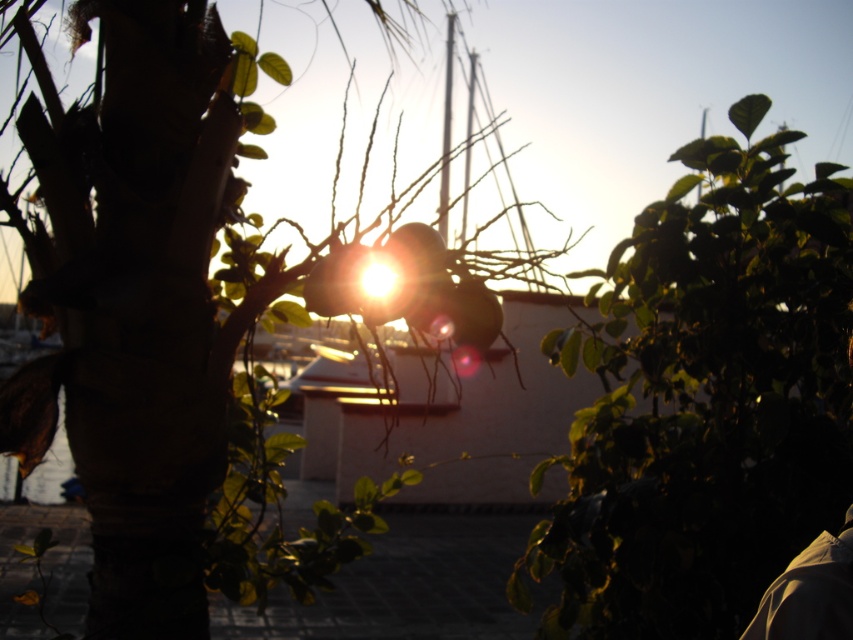
Question: Considering the relative positions of green leafy tree at center and green leafy plant at upper right in the image provided, where is green leafy tree at center located with respect to green leafy plant at upper right?

Choices:
 (A) above
 (B) below

Answer: (A)

Question: Does green leafy tree at center appear on the left side of green leafy plant at upper right?

Choices:
 (A) yes
 (B) no

Answer: (A)

Question: Can you confirm if green leafy tree at center is thinner than green leafy plant at upper right?

Choices:
 (A) yes
 (B) no

Answer: (B)

Question: Which object is closer to the camera taking this photo?

Choices:
 (A) green leafy plant at upper right
 (B) green leafy tree at center

Answer: (B)

Question: Which point is farther to the camera?

Choices:
 (A) green leafy tree at center
 (B) green leafy plant at upper right

Answer: (B)

Question: Among these points, which one is nearest to the camera?

Choices:
 (A) (637, 305)
 (B) (39, 230)

Answer: (B)